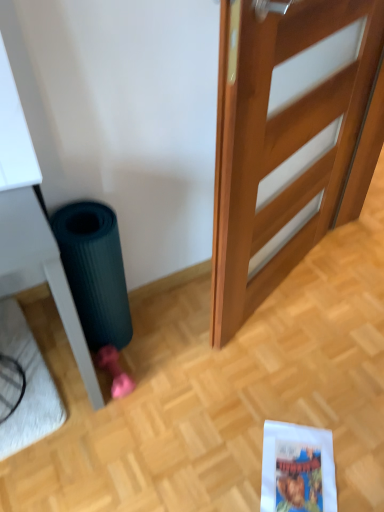
The height and width of the screenshot is (512, 384). I want to click on vacant region below wooden door at center (from a real-world perspective), so click(x=271, y=305).